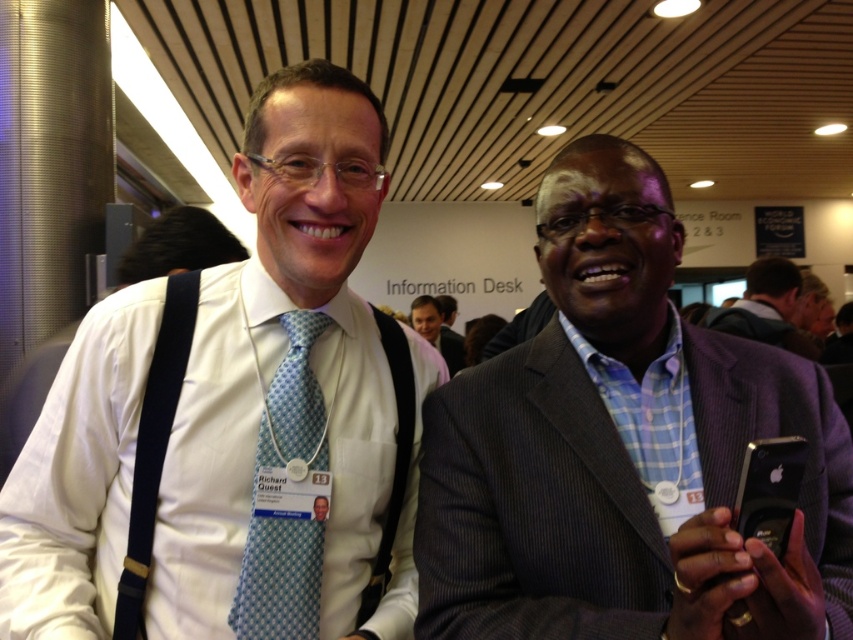
The height and width of the screenshot is (640, 853). Find the location of `gray pinstripe suit at center`. gray pinstripe suit at center is located at coordinates [622, 449].

The height and width of the screenshot is (640, 853). In order to click on gray pinstripe suit at center in this screenshot , I will do `click(622, 449)`.

This screenshot has width=853, height=640. What are the coordinates of `gray pinstripe suit at center` in the screenshot? It's located at (622, 449).

Does white shirt at left lie behind gray fabric jacket at right?

No, it is not.

Based on the photo, which of these two, white shirt at left or gray fabric jacket at right, stands shorter?

gray fabric jacket at right is shorter.

Is point (366, 160) more distant than point (738, 326)?

No, it is in front of (738, 326).

This screenshot has width=853, height=640. Find the location of `white shirt at left`. white shirt at left is located at coordinates (234, 420).

Is gray pinstripe suit at center above blue dotted tie at center?

Yes, gray pinstripe suit at center is above blue dotted tie at center.

Who is higher up, gray pinstripe suit at center or blue dotted tie at center?

Positioned higher is gray pinstripe suit at center.

Does point (706, 396) lie behind point (312, 326)?

No.

This screenshot has height=640, width=853. In order to click on gray pinstripe suit at center in this screenshot , I will do `click(622, 449)`.